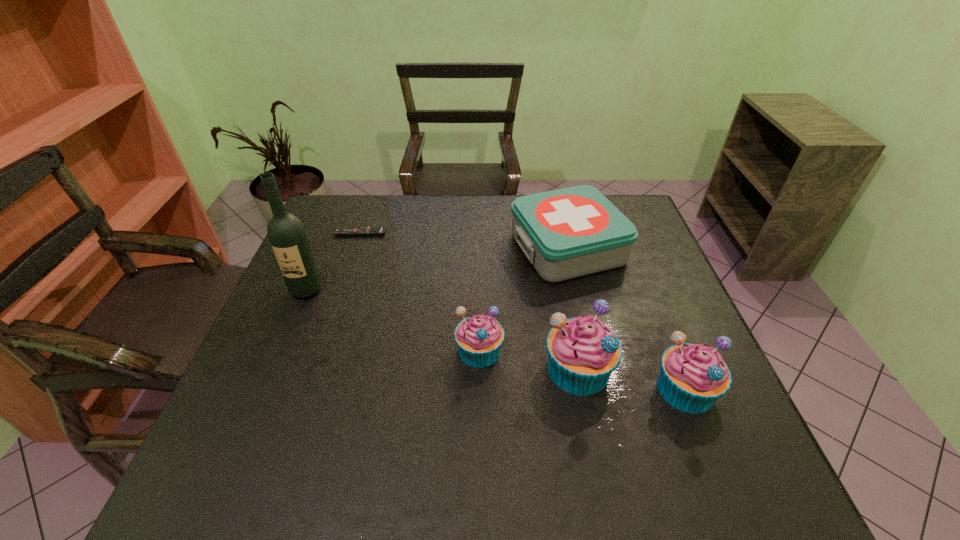
Locate which object ranks fourth in proximity to the wine bottle. Please provide its 2D coordinates. Your answer should be formatted as a tuple, i.e. [(x, y)], where the tuple contains the x and y coordinates of a point satisfying the conditions above.

[(583, 352)]

Find the location of a particular element. muffin that stands as the second closest to the wine bottle is located at coordinates (583, 352).

Identify the location of the second closest muffin to the first-aid kit. (583, 352).

Locate an element on the screen. This screenshot has height=540, width=960. vacant space that satisfies the following two spatial constraints: 1. on the labeled side of the second muffin from left to right; 2. on the right side of the tallest object is located at coordinates (x=273, y=369).

Find the location of `free space that satisfies the following two spatial constraints: 1. on the labeled side of the wine bottle; 2. on the left side of the leftmost muffin`. free space that satisfies the following two spatial constraints: 1. on the labeled side of the wine bottle; 2. on the left side of the leftmost muffin is located at coordinates (280, 350).

At what (x,y) coordinates should I click in order to perform the action: click on vacant space that satisfies the following two spatial constraints: 1. on the labeled side of the second muffin from right to left; 2. on the left side of the tallest object. Please return your answer as a coordinate pair (x, y). Looking at the image, I should click on (x=273, y=369).

The height and width of the screenshot is (540, 960). Find the location of `free spot that satisfies the following two spatial constraints: 1. on the front side of the first-aid kit; 2. on the left side of the remote control`. free spot that satisfies the following two spatial constraints: 1. on the front side of the first-aid kit; 2. on the left side of the remote control is located at coordinates (355, 248).